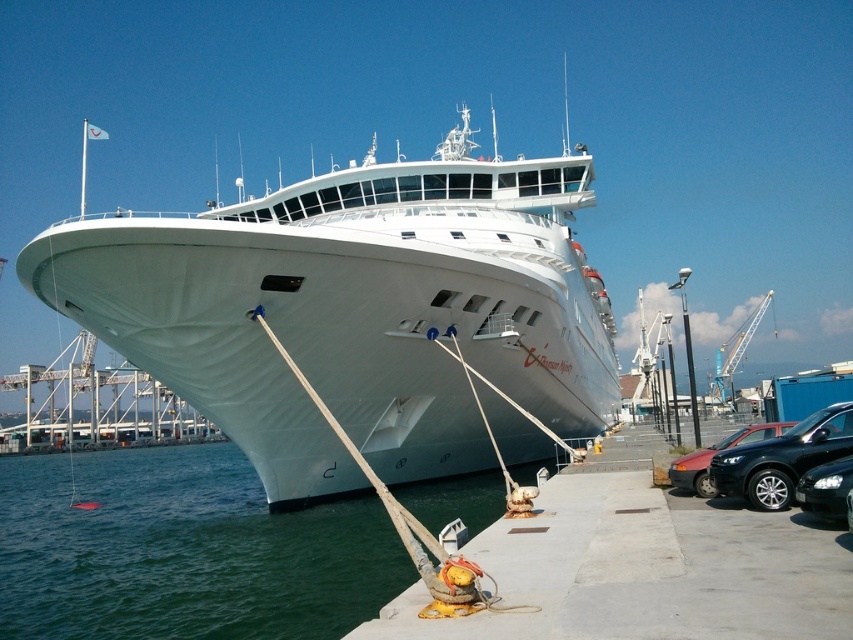
Question: Which object appears farthest from the camera in this image?

Choices:
 (A) black glossy sedan at lower right
 (B) matte black car at lower right
 (C) black glossy car at lower right
 (D) green water at lower left

Answer: (B)

Question: Which of these objects is positioned farthest from the black glossy car at lower right?

Choices:
 (A) green water at lower left
 (B) matte black car at lower right

Answer: (A)

Question: Is white glossy cruise ship at center closer to camera compared to green water at lower left?

Choices:
 (A) yes
 (B) no

Answer: (B)

Question: Is matte black car at lower right to the right of black glossy sedan at lower right from the viewer's perspective?

Choices:
 (A) yes
 (B) no

Answer: (A)

Question: Which object appears closest to the camera in this image?

Choices:
 (A) green water at lower left
 (B) matte black car at lower right
 (C) white glossy cruise ship at center
 (D) black glossy car at lower right

Answer: (D)

Question: Does matte black car at lower right have a larger size compared to black glossy sedan at lower right?

Choices:
 (A) yes
 (B) no

Answer: (A)